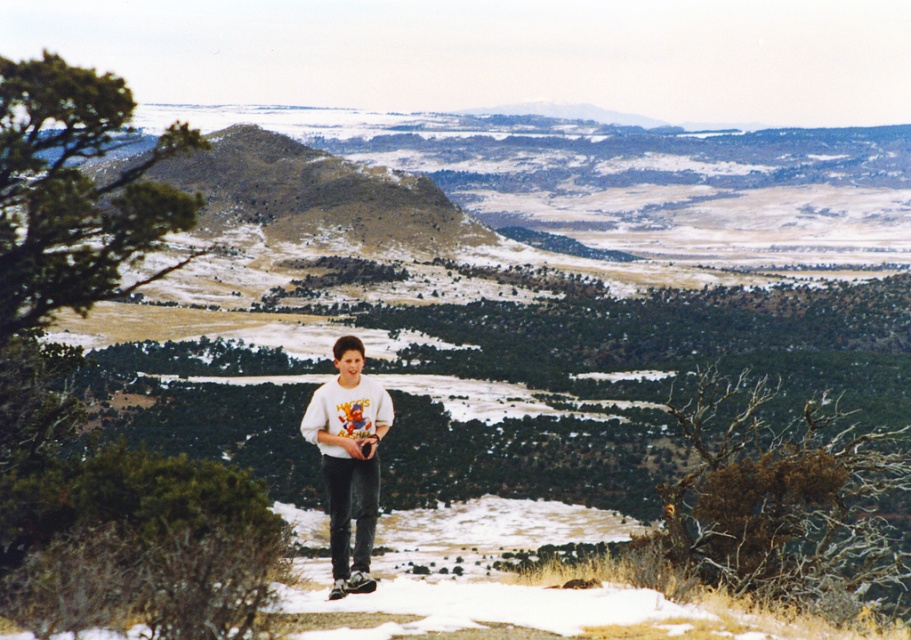
You are a photographer trying to capture a landscape photo. You are standing at the camera position and see the white cotton shirt at center in the frame. If you want to include both the shirt and the distant hills in your photo, will you need to adjust your camera angle upwards or downwards?

The white cotton shirt at center is 87.35 feet away from the camera. Since the shirt is closer to the camera than the distant hills, you would need to tilt your camera upwards to include both the shirt and the distant hills in the photo.